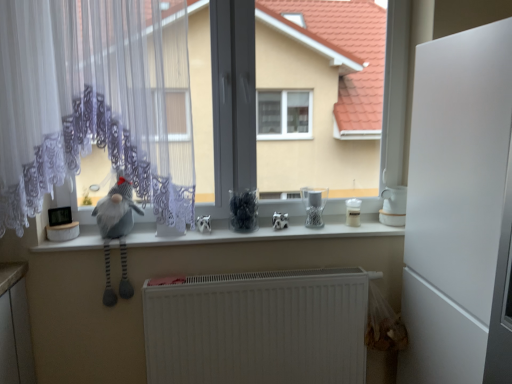
The height and width of the screenshot is (384, 512). Identify the location of free location in front of clear glass jar at center, which is counted as the 3th appliance, starting from the right. (323, 231).